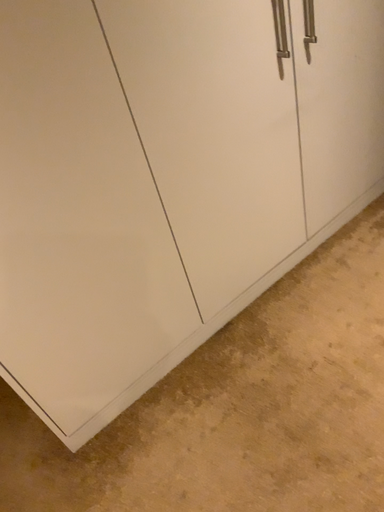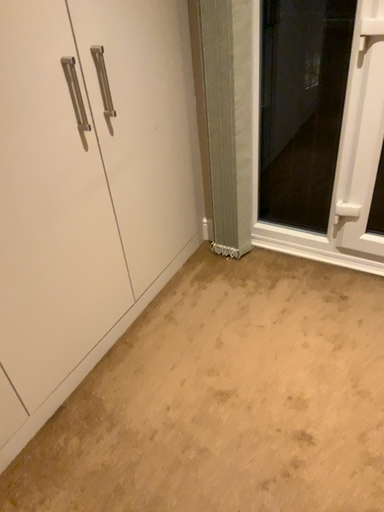
Question: Which way did the camera rotate in the video?

Choices:
 (A) rotated upward
 (B) rotated downward

Answer: (A)